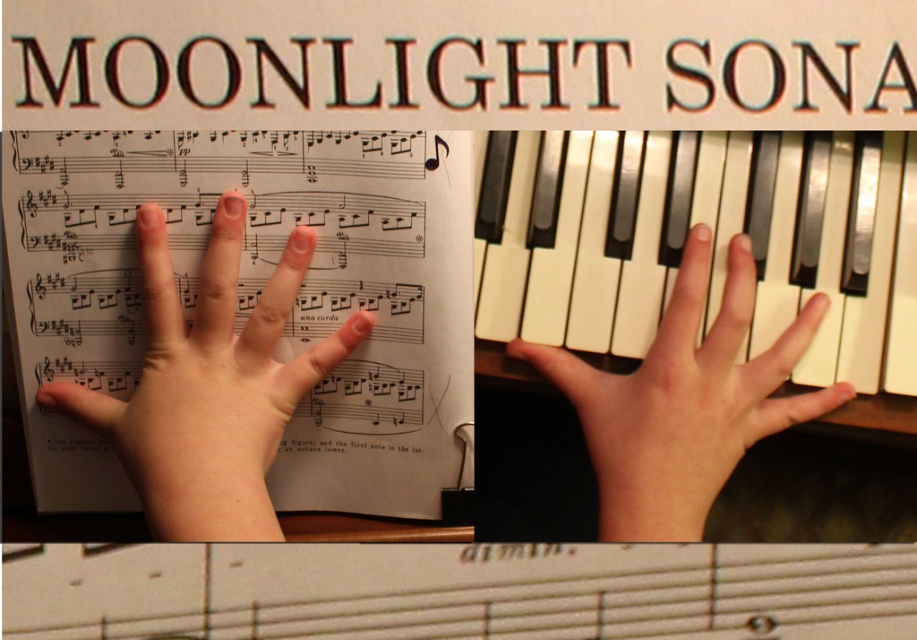
Consider the image. Where are the white glossy piano keys at center located in the middle left section?

The white glossy piano keys at center are located at point [671,250] in the middle left section.

You are observing a piano lesson where a child is learning to play the piano. You see the pale skin hand at upper left and the smooth skin hand at upper center on the sheet music. Which hand is positioned more to the left on the sheet?

The pale skin hand at upper left is positioned more to the left on the sheet.